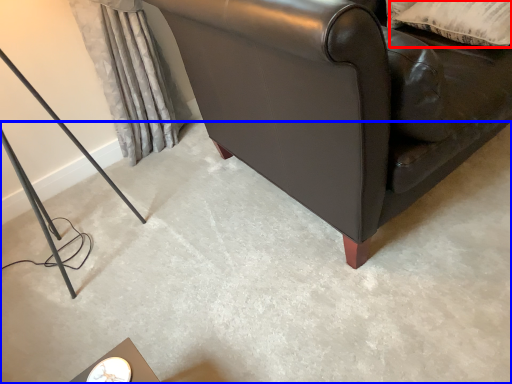
Question: Which object appears farthest to the camera in this image, pillow (highlighted by a red box) or concrete (highlighted by a blue box)?

Choices:
 (A) pillow
 (B) concrete

Answer: (A)